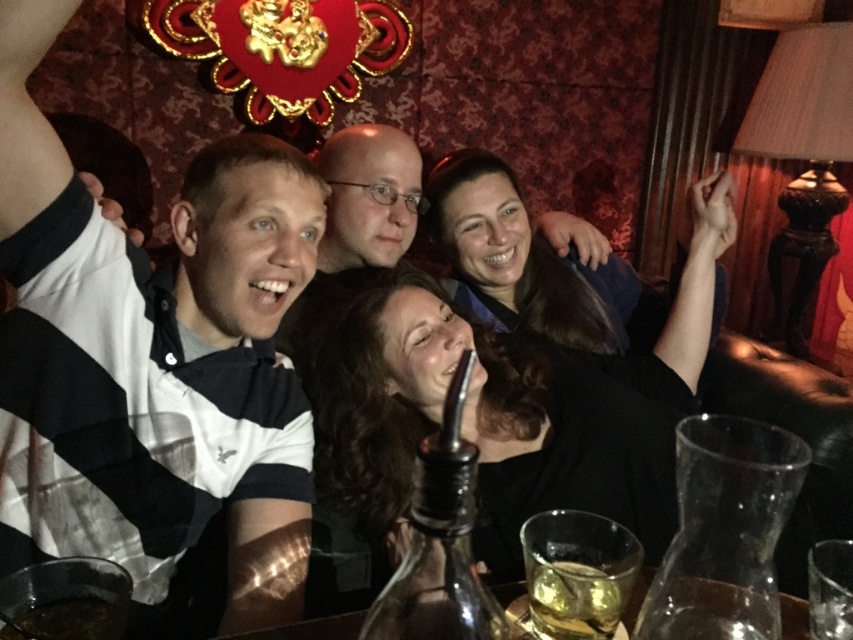
Does translucent glass at center appear on the right side of brown liquid at lower left?

Yes, translucent glass at center is to the right of brown liquid at lower left.

Can you confirm if translucent glass at center is positioned below brown liquid at lower left?

No.

Is point (590, 573) positioned before point (96, 632)?

No, (590, 573) is further to viewer.

Where is `translucent glass at center`? The height and width of the screenshot is (640, 853). translucent glass at center is located at coordinates (573, 600).